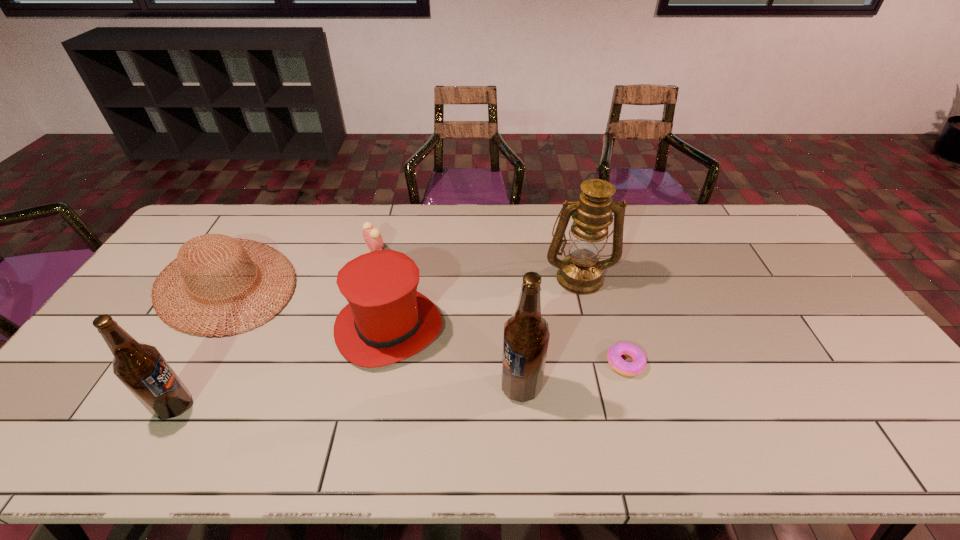
At what (x,y) coordinates should I click in order to perform the action: click on object that is positioned at the far left corner. Please return your answer as a coordinate pair (x, y). Looking at the image, I should click on (195, 254).

Where is `vacant region at the far edge of the desktop`? vacant region at the far edge of the desktop is located at coordinates (475, 233).

Locate an element on the screen. The image size is (960, 540). free space at the near edge of the desktop is located at coordinates (575, 392).

In the image, there is a desktop. Where is `vacant space at the right edge`? vacant space at the right edge is located at coordinates (838, 319).

Find the location of a particular element. vacant region at the near left corner of the desktop is located at coordinates (105, 389).

Find the location of a particular element. vacant space at the far right corner of the desktop is located at coordinates (759, 240).

At what (x,y) coordinates should I click in order to perform the action: click on free point between the shorter beer bottle and the doughnut. Please return your answer as a coordinate pair (x, y). The image size is (960, 540). Looking at the image, I should click on (399, 384).

What are the coordinates of `free space between the oil lamp and the hat` in the screenshot? It's located at pyautogui.click(x=484, y=302).

Find the location of a particular element. The height and width of the screenshot is (540, 960). empty location between the fourth shortest object and the third shortest object is located at coordinates (307, 306).

Locate an element on the screen. empty location between the fifth object from left to right and the sixth tallest object is located at coordinates 448,319.